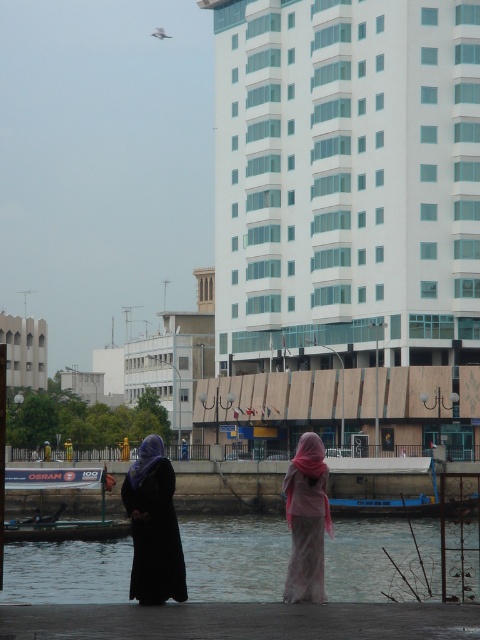
Question: Is smooth water at lower center wider than white stone building at left?

Choices:
 (A) yes
 (B) no

Answer: (B)

Question: Which is farther from the matte black hijab at lower left?

Choices:
 (A) dark gray concrete dock at lower center
 (B) white stone building at left
 (C) smooth water at lower center

Answer: (B)

Question: Considering the relative positions of smooth water at lower center and white stone building at left in the image provided, where is smooth water at lower center located with respect to white stone building at left?

Choices:
 (A) below
 (B) above

Answer: (A)

Question: From the image, what is the correct spatial relationship of smooth water at lower center in relation to dark gray concrete dock at lower center?

Choices:
 (A) above
 (B) below

Answer: (B)

Question: Estimate the real-world distances between objects in this image. Which object is closer to the matte black hijab at lower left?

Choices:
 (A) white glass building at upper center
 (B) white stone building at left
 (C) smooth water at lower center

Answer: (C)

Question: Estimate the real-world distances between objects in this image. Which object is closer to the dark gray concrete dock at lower center?

Choices:
 (A) matte black hijab at lower left
 (B) white glass building at upper center

Answer: (A)